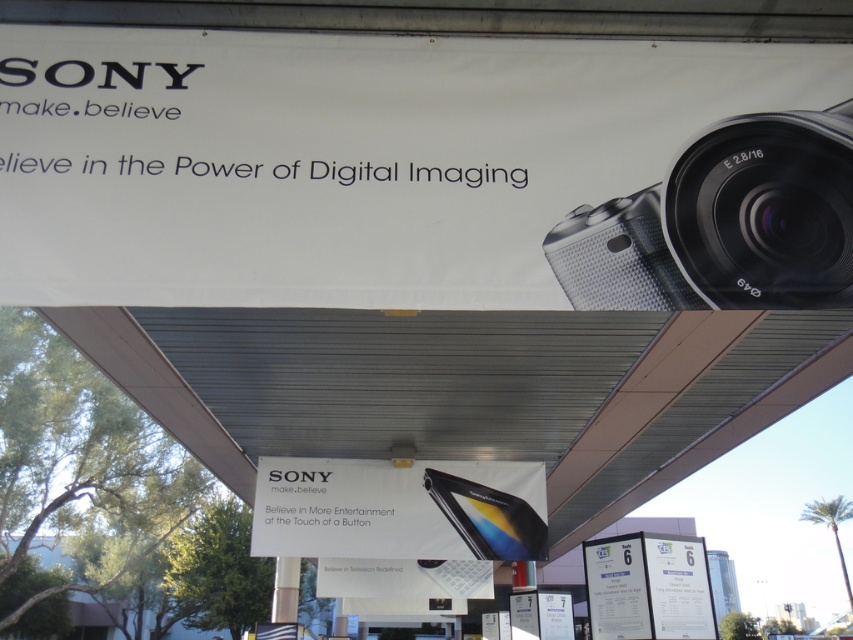
Which is in front, point (727, 296) or point (480, 481)?

Point (727, 296) is more forward.

Which is below, silver textured camera at upper right or black glossy smartphone at center?

Positioned lower is black glossy smartphone at center.

Identify the location of silver textured camera at upper right. The image size is (853, 640). (723, 224).

Where is `silver textured camera at upper right`? The height and width of the screenshot is (640, 853). silver textured camera at upper right is located at coordinates (723, 224).

Between silver textured camera at upper right and white paper at lower right, which one appears on the left side from the viewer's perspective?

silver textured camera at upper right

Does silver textured camera at upper right have a larger size compared to white paper at lower right?

Incorrect, silver textured camera at upper right is not larger than white paper at lower right.

The image size is (853, 640). What are the coordinates of `silver textured camera at upper right` in the screenshot? It's located at (723, 224).

Does black glossy smartphone at center have a greater height compared to white paper at lower right?

→ In fact, black glossy smartphone at center may be shorter than white paper at lower right.

Identify the location of black glossy smartphone at center. (369, 506).

Between point (380, 467) and point (587, 557), which one is positioned behind?

Positioned behind is point (587, 557).

At what (x,y) coordinates should I click in order to perform the action: click on black glossy smartphone at center. Please return your answer as a coordinate pair (x, y). Image resolution: width=853 pixels, height=640 pixels. Looking at the image, I should click on (369, 506).